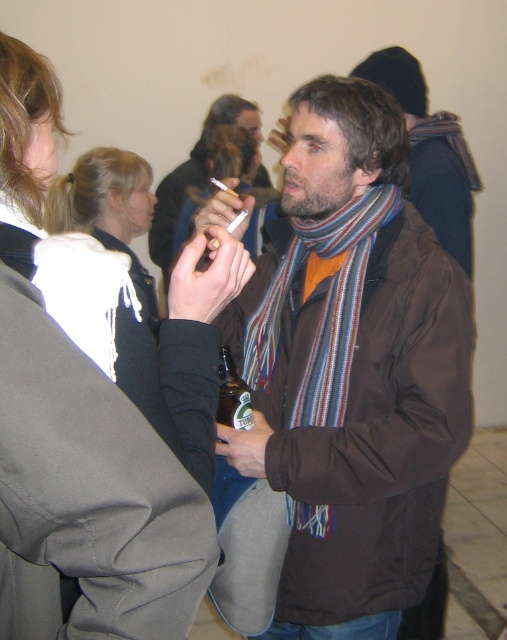
Which is more to the left, brown matte jacket at center or white fabric scarf at upper left?

white fabric scarf at upper left is more to the left.

Is brown matte jacket at center below white fabric scarf at upper left?

Indeed, brown matte jacket at center is positioned under white fabric scarf at upper left.

Who is more distant from viewer, [276,472] or [137,168]?

Point [137,168]

Image resolution: width=507 pixels, height=640 pixels. What are the coordinates of `brown matte jacket at center` in the screenshot? It's located at (351, 369).

Identify the location of brown matte jacket at center. The image size is (507, 640). (351, 369).

Which is above, brown matte jacket at center or striped scarf at center?

striped scarf at center

Does point (469, 396) come closer to viewer compared to point (263, 182)?

Yes, it is.

Image resolution: width=507 pixels, height=640 pixels. Identify the location of brown matte jacket at center. (351, 369).

The width and height of the screenshot is (507, 640). Describe the element at coordinates (194, 173) in the screenshot. I see `striped scarf at center` at that location.

Where is `striped scarf at center`? striped scarf at center is located at coordinates (194, 173).

Image resolution: width=507 pixels, height=640 pixels. I want to click on striped scarf at center, so (194, 173).